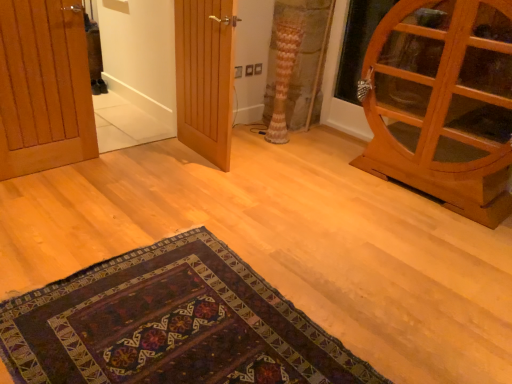
At what (x,y) coordinates should I click in order to perform the action: click on empty space that is ontop of dark woven rug at lower center. Please return your answer as a coordinate pair (x, y). Looking at the image, I should click on coord(169,328).